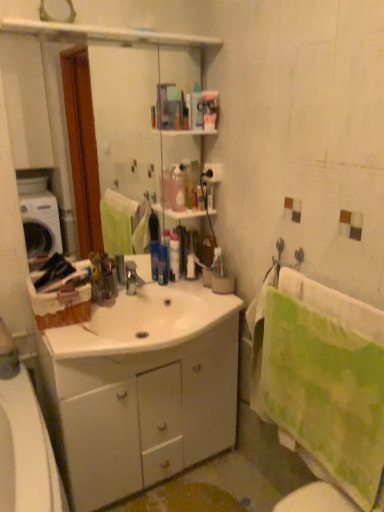
You are a GUI agent. You are given a task and a screenshot of the screen. Output one action in this format:
    pyautogui.click(x=<x>, y=<y>)
    Task: Click on the translucent plastic bottle at center, arranged as the 2th toiletry when viewed from the left
    The width and height of the screenshot is (384, 512).
    Given the screenshot: What is the action you would take?
    pyautogui.click(x=174, y=257)

Image resolution: width=384 pixels, height=512 pixels. What do you see at coordinates (214, 172) in the screenshot? I see `white matte toilet paper at center` at bounding box center [214, 172].

Where is `translucent plastic toothbrush at upper center, acting as the fourth toiletry starting from the left`? translucent plastic toothbrush at upper center, acting as the fourth toiletry starting from the left is located at coordinates (217, 262).

The width and height of the screenshot is (384, 512). What are the coordinates of `green textured towel at right` in the screenshot? It's located at (320, 387).

Describe the element at coordinates (177, 189) in the screenshot. I see `pink translucent bottle at upper center` at that location.

Locate an element on the screen. The image size is (384, 512). metallic silver faucet at center is located at coordinates (132, 278).

Describe the element at coordinates (132, 278) in the screenshot. This screenshot has height=512, width=384. I see `metallic silver faucet at center` at that location.

Locate an element on the screen. clear glass mirror at upper center is located at coordinates (111, 36).

Image resolution: width=384 pixels, height=512 pixels. Find the location of `translucent plastic bottle at center, arranged as the 2th toiletry when viewed from the left`. translucent plastic bottle at center, arranged as the 2th toiletry when viewed from the left is located at coordinates (174, 257).

Is point (178, 280) positioned behind point (204, 168)?

No.

Would you say white matte toilet paper at center is part of translucent plastic bottle at center, arranged as the 2th toiletry when viewed from the left,'s contents?

No, white matte toilet paper at center is not a part of translucent plastic bottle at center, arranged as the 2th toiletry when viewed from the left.

Locate an element on the screen. the 1st toiletry below the white matte toilet paper at center (from a real-world perspective) is located at coordinates (174, 257).

Is translucent plastic bottle at center, arranged as the 2th toiletry when viewed from the left, looking in the opposite direction of white matte toilet paper at center?

No.

Does point (165, 259) come farther from viewer compared to point (351, 343)?

Yes.

Is blue glossy bottle at center, the 1th toiletry when ordered from left to right, wider or thinner than green textured towel at right?

blue glossy bottle at center, the 1th toiletry when ordered from left to right, is thinner than green textured towel at right.

Is blue glossy bottle at center, the 4th toiletry positioned from the right, located outside green textured towel at right?

That's correct, blue glossy bottle at center, the 4th toiletry positioned from the right, is outside of green textured towel at right.

Is blue glossy bottle at center, the 1th toiletry when ordered from left to right, at the left side of green textured towel at right?

Yes, blue glossy bottle at center, the 1th toiletry when ordered from left to right, is to the left of green textured towel at right.

From the image's perspective, who appears lower, green textured towel at right or white glossy cabinet at center?

white glossy cabinet at center, from the image's perspective.

The image size is (384, 512). What are the coordinates of `bath towel that appears above the white glossy cabinet at center (from a real-world perspective)` in the screenshot? It's located at tap(320, 387).

Between green textured towel at right and white glossy cabinet at center, which one has smaller size?

With smaller size is green textured towel at right.

Which is correct: green textured towel at right is inside white glossy cabinet at center, or outside of it?

The correct answer is: outside.

Does green textured towel at right have a larger size compared to white matte toilet paper at center?

Correct, green textured towel at right is larger in size than white matte toilet paper at center.

Looking at this image, between green textured towel at right and white matte toilet paper at center, which one appears on the left side from the viewer's perspective?

Positioned to the left is white matte toilet paper at center.

From the image's perspective, is green textured towel at right above white matte toilet paper at center?

Incorrect, from the image's perspective, green textured towel at right is lower than white matte toilet paper at center.

Which is correct: green textured towel at right is inside white matte toilet paper at center, or outside of it?

green textured towel at right exists outside the volume of white matte toilet paper at center.

Considering the positions of points (190, 275) and (157, 42), is point (190, 275) closer to camera compared to point (157, 42)?

That is False.

Is translucent plastic container at center, which appears as the 3th toiletry when viewed from the left, positioned in front of clear glass mirror at upper center?

No, translucent plastic container at center, which appears as the 3th toiletry when viewed from the left, is further to the viewer.

From the image's perspective, is translucent plastic container at center, marked as the 2th toiletry in a right-to-left arrangement, under clear glass mirror at upper center?

Indeed, from the image's perspective, translucent plastic container at center, marked as the 2th toiletry in a right-to-left arrangement, is shown beneath clear glass mirror at upper center.

Is translucent plastic container at center, marked as the 2th toiletry in a right-to-left arrangement, facing towards clear glass mirror at upper center?

No, translucent plastic container at center, marked as the 2th toiletry in a right-to-left arrangement, is not turned towards clear glass mirror at upper center.

Between metallic silver faucet at center and white matte toilet paper at center, which one is positioned behind?

white matte toilet paper at center is more distant.

From the image's perspective, between metallic silver faucet at center and white matte toilet paper at center, who is located below?

metallic silver faucet at center is shown below in the image.

Does metallic silver faucet at center turn towards white matte toilet paper at center?

No, metallic silver faucet at center is not oriented towards white matte toilet paper at center.

Is metallic silver faucet at center surrounding white matte toilet paper at center?

No, white matte toilet paper at center is not inside metallic silver faucet at center.

Would you say translucent plastic toothbrush at upper center, acting as the fourth toiletry starting from the left, is inside or outside white matte toilet paper at center?

The correct answer is: outside.

Could you measure the distance between translucent plastic toothbrush at upper center, acting as the fourth toiletry starting from the left, and white matte toilet paper at center?

translucent plastic toothbrush at upper center, acting as the fourth toiletry starting from the left, and white matte toilet paper at center are 14.23 inches apart from each other.

Is translucent plastic toothbrush at upper center, acting as the fourth toiletry starting from the left, behind white matte toilet paper at center?

Yes, translucent plastic toothbrush at upper center, acting as the fourth toiletry starting from the left, is further from the camera.

Is translucent plastic toothbrush at upper center, acting as the fourth toiletry starting from the left, taller or shorter than white matte toilet paper at center?

In the image, translucent plastic toothbrush at upper center, acting as the fourth toiletry starting from the left, appears to be taller than white matte toilet paper at center.

From a real-world perspective, count 1st toiletrys downward from the white matte toilet paper at center and point to it. Please provide its 2D coordinates.

[(174, 257)]

The image size is (384, 512). What are the coordinates of `the 2nd toiletry behind the green textured towel at right` in the screenshot? It's located at (162, 264).

Considering their positions, is translucent plastic bottle at center, which is the third toiletry in right-to-left order, positioned further to translucent plastic container at center, which appears as the 3th toiletry when viewed from the left, than metallic silver faucet at center?

metallic silver faucet at center lies further to translucent plastic container at center, which appears as the 3th toiletry when viewed from the left, than the other object.

Looking at this image, when comparing their distances from white glossy cabinet at center, does metallic silver faucet at center or translucent plastic toothbrush at upper center, the 1th toiletry in the right-to-left sequence, seem closer?

Among the two, metallic silver faucet at center is located nearer to white glossy cabinet at center.

Based on their spatial positions, is clear glass mirror at upper center or blue glossy bottle at center, the 4th toiletry positioned from the right, closer to translucent plastic toothbrush at upper center, acting as the fourth toiletry starting from the left?

Among the two, blue glossy bottle at center, the 4th toiletry positioned from the right, is located nearer to translucent plastic toothbrush at upper center, acting as the fourth toiletry starting from the left.

When comparing their distances from translucent plastic toothbrush at upper center, the 1th toiletry in the right-to-left sequence, does blue glossy bottle at center, the 1th toiletry when ordered from left to right, or green textured towel at right seem closer?

blue glossy bottle at center, the 1th toiletry when ordered from left to right, is closer to translucent plastic toothbrush at upper center, the 1th toiletry in the right-to-left sequence.

Based on their spatial positions, is blue glossy bottle at center, the 4th toiletry positioned from the right, or pink translucent bottle at upper center closer to metallic silver faucet at center?

The object closer to metallic silver faucet at center is blue glossy bottle at center, the 4th toiletry positioned from the right.

From the image, which object appears to be nearer to pink translucent bottle at upper center, metallic silver faucet at center or translucent plastic toothbrush at upper center, the 1th toiletry in the right-to-left sequence?

translucent plastic toothbrush at upper center, the 1th toiletry in the right-to-left sequence, lies closer to pink translucent bottle at upper center than the other object.

Based on their spatial positions, is pink translucent bottle at upper center or green textured towel at right further from white glossy cabinet at center?

pink translucent bottle at upper center lies further to white glossy cabinet at center than the other object.

Which object lies nearer to the anchor point blue glossy bottle at center, the 1th toiletry when ordered from left to right, translucent plastic container at center, which appears as the 3th toiletry when viewed from the left, or pink translucent bottle at upper center?

translucent plastic container at center, which appears as the 3th toiletry when viewed from the left.

Where is `tap between green textured towel at right and translucent plastic container at center, marked as the 2th toiletry in a right-to-left arrangement, along the z-axis`? tap between green textured towel at right and translucent plastic container at center, marked as the 2th toiletry in a right-to-left arrangement, along the z-axis is located at coordinates (132, 278).

Where is `mirror located between green textured towel at right and blue glossy bottle at center, the 1th toiletry when ordered from left to right, in the depth direction`? mirror located between green textured towel at right and blue glossy bottle at center, the 1th toiletry when ordered from left to right, in the depth direction is located at coordinates (111, 36).

The width and height of the screenshot is (384, 512). Find the location of `cleaning product between white matte toilet paper at center and translucent plastic bottle at center, arranged as the 2th toiletry when viewed from the left, in the up-down direction`. cleaning product between white matte toilet paper at center and translucent plastic bottle at center, arranged as the 2th toiletry when viewed from the left, in the up-down direction is located at coordinates (177, 189).

Where is `bathroom cabinet between green textured towel at right and blue glossy bottle at center, the 4th toiletry positioned from the right, along the z-axis`? The width and height of the screenshot is (384, 512). bathroom cabinet between green textured towel at right and blue glossy bottle at center, the 4th toiletry positioned from the right, along the z-axis is located at coordinates point(143,390).